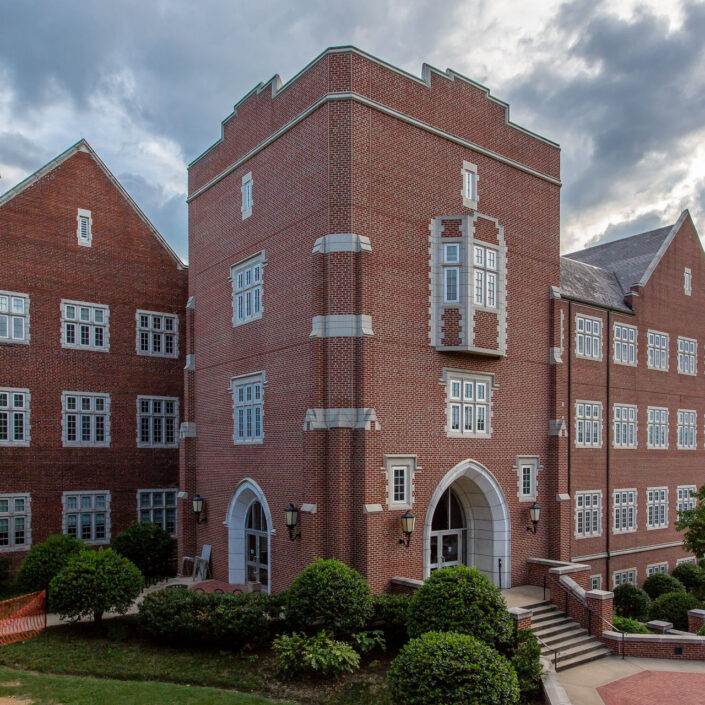
Identify the location of top window. (85, 226), (249, 194), (471, 180), (684, 278).